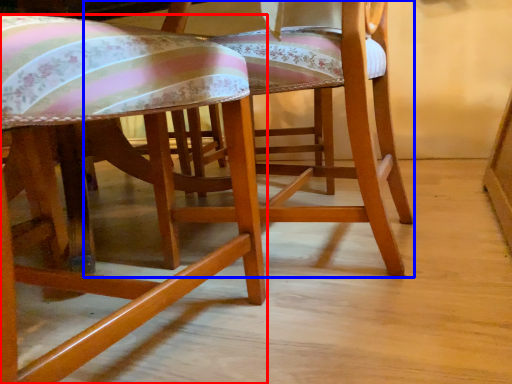
Question: Which object appears closest to the camera in this image, chair (highlighted by a red box) or chair (highlighted by a blue box)?

Choices:
 (A) chair
 (B) chair

Answer: (A)